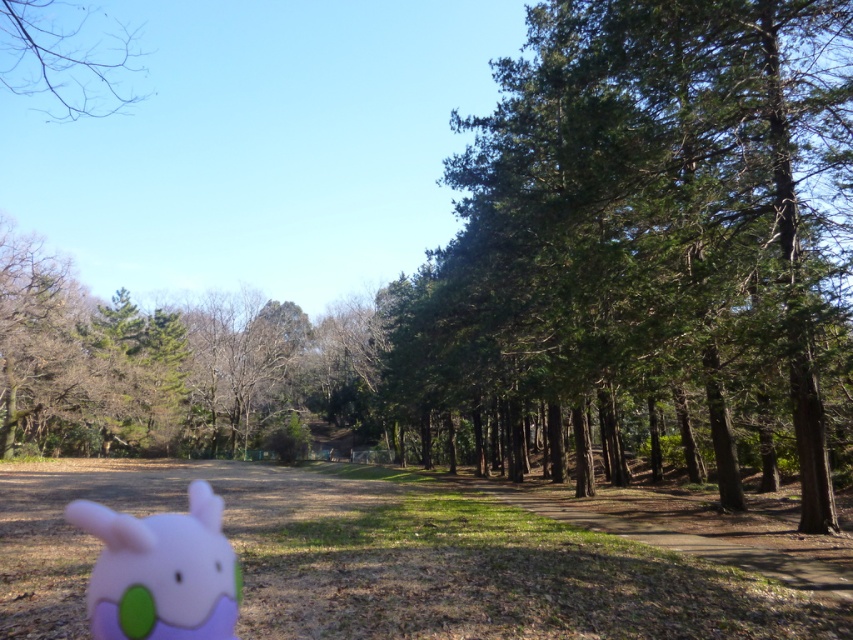
What do you see at coordinates (161, 572) in the screenshot?
I see `plush pink toy at lower left` at bounding box center [161, 572].

Does plush pink toy at lower left have a larger size compared to bare branches at upper left?

Actually, plush pink toy at lower left might be smaller than bare branches at upper left.

What do you see at coordinates (161, 572) in the screenshot?
I see `plush pink toy at lower left` at bounding box center [161, 572].

Find the location of `plush pink toy at lower left`. plush pink toy at lower left is located at coordinates (161, 572).

Is point (637, 280) positioned behind point (202, 611)?

That is True.

Does green textured tree at center have a greater height compared to plush pink toy at lower left?

Correct, green textured tree at center is much taller as plush pink toy at lower left.

Is point (756, 35) positioned in front of point (160, 602)?

No, it is not.

You are a GUI agent. You are given a task and a screenshot of the screen. Output one action in this format:
    pyautogui.click(x=<x>, y=<y>)
    Task: Click on the green textured tree at center
    Image resolution: width=853 pixels, height=640 pixels.
    Given the screenshot: What is the action you would take?
    pyautogui.click(x=653, y=236)

Is green textured tree at center thinner than bare branches at upper left?

Indeed, green textured tree at center has a lesser width compared to bare branches at upper left.

Who is more forward, (416, 369) or (57, 67)?

Positioned in front is point (416, 369).

Find the location of a particular element. green textured tree at center is located at coordinates (653, 236).